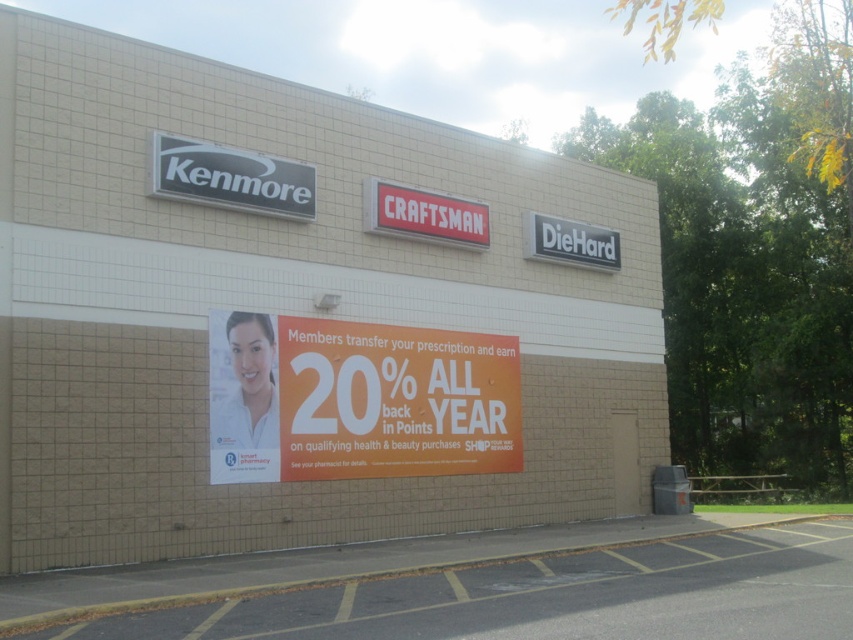
Question: Is orange paper sign at center above black plastic sign at upper center?

Choices:
 (A) yes
 (B) no

Answer: (B)

Question: Can you confirm if orange paper sign at center is positioned to the right of black plastic sign at upper center?

Choices:
 (A) yes
 (B) no

Answer: (B)

Question: Can you confirm if white brick wall at center is positioned above orange paper sign at center?

Choices:
 (A) yes
 (B) no

Answer: (A)

Question: Which point is farther from the camera taking this photo?

Choices:
 (A) (274, 189)
 (B) (190, 474)
 (C) (376, 474)

Answer: (C)

Question: Which object is the farthest from the orange paper sign at center?

Choices:
 (A) white brick wall at center
 (B) black plastic sign at upper center

Answer: (A)

Question: Which object is the farthest from the white brick wall at center?

Choices:
 (A) black plastic sign at upper center
 (B) orange paper sign at center

Answer: (B)